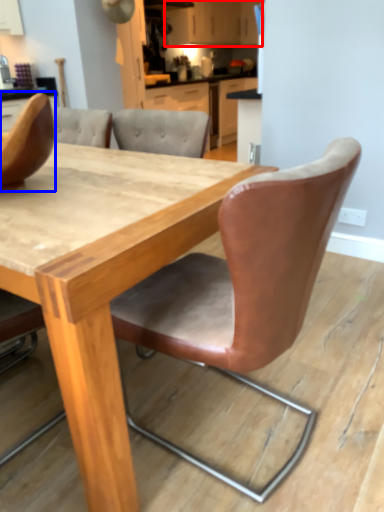
Question: Which object appears farthest to the camera in this image, cabinetry (highlighted by a red box) or chair (highlighted by a blue box)?

Choices:
 (A) cabinetry
 (B) chair

Answer: (A)